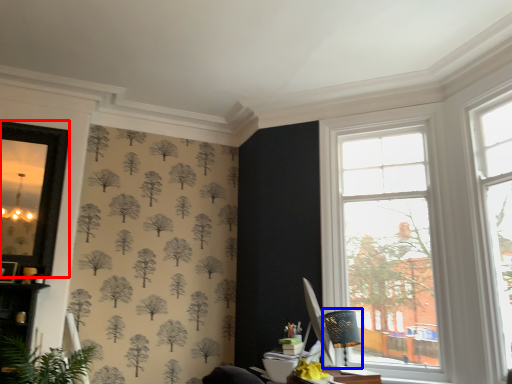
Question: Among these objects, which one is nearest to the camera, window screen (highlighted by a red box) or table lamp (highlighted by a blue box)?

Choices:
 (A) window screen
 (B) table lamp

Answer: (B)